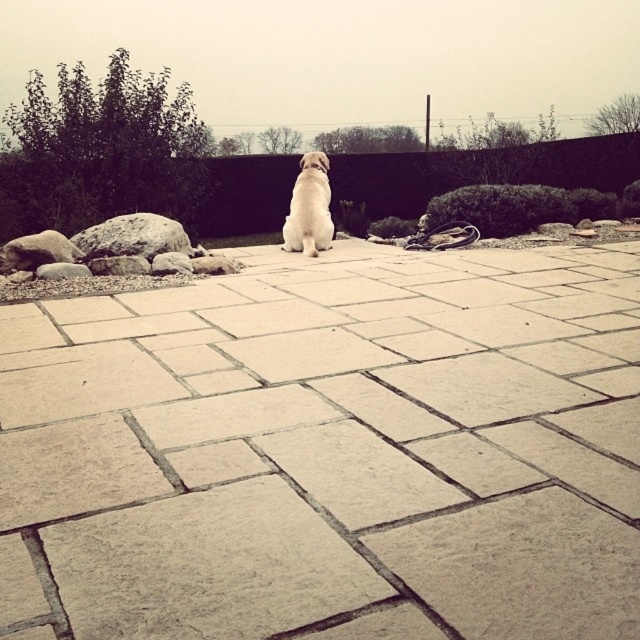
Question: Is beige stone pavement at center above gray rock at center?

Choices:
 (A) no
 (B) yes

Answer: (A)

Question: Which point is farther to the camera?

Choices:
 (A) (336, 452)
 (B) (166, 257)

Answer: (B)

Question: Does beige stone pavement at center appear on the left side of gray rock at center?

Choices:
 (A) no
 (B) yes

Answer: (A)

Question: Is beige stone pavement at center positioned at the back of gray rock at center?

Choices:
 (A) yes
 (B) no

Answer: (B)

Question: Which of the following is the closest to the observer?

Choices:
 (A) (163, 273)
 (B) (244, 454)

Answer: (B)